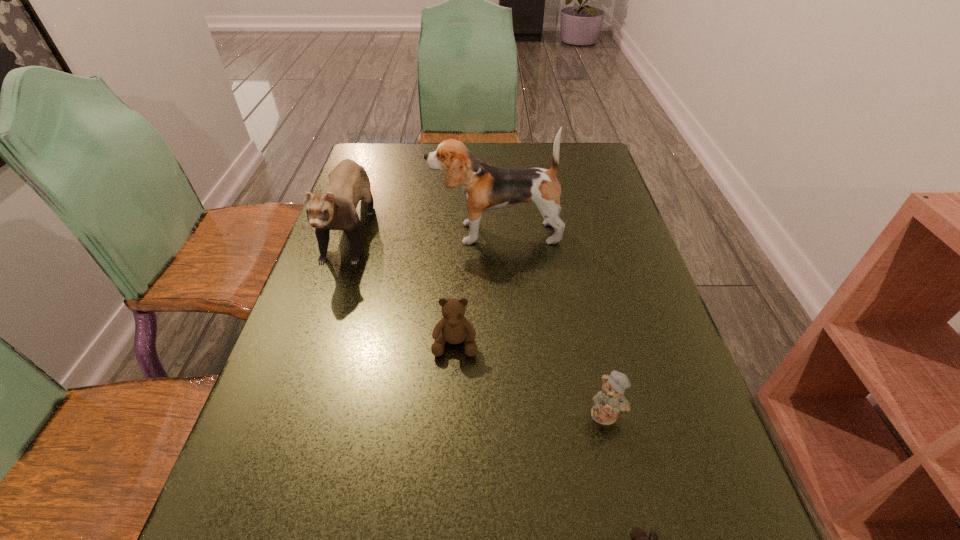
Find the location of `vacant space that satisfies the following two spatial constraints: 1. at the face of the tallest object; 2. on the front-facing side of the leftmost teddy bear`. vacant space that satisfies the following two spatial constraints: 1. at the face of the tallest object; 2. on the front-facing side of the leftmost teddy bear is located at coordinates (500, 342).